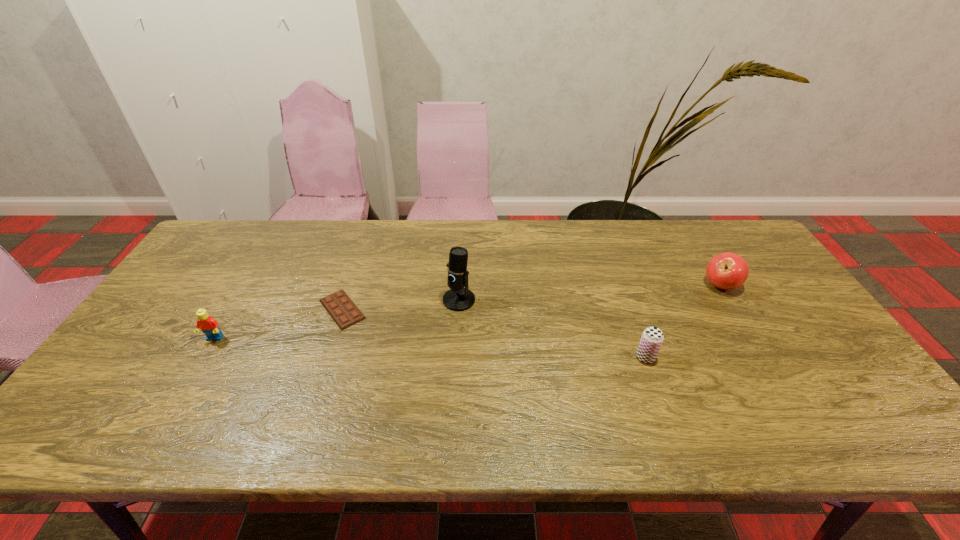
Locate which object is the fourth closest to the second object from right to left. Please provide its 2D coordinates. Your answer should be formatted as a tuple, i.e. [(x, y)], where the tuple contains the x and y coordinates of a point satisfying the conditions above.

[(207, 324)]

What are the coordinates of `vacant region that satisfies the following two spatial constraints: 1. on the face of the fourth farthest object; 2. on the left side of the beer can` in the screenshot? It's located at (204, 357).

This screenshot has height=540, width=960. In order to click on vacant space that satisfies the following two spatial constraints: 1. on the back side of the fourth object from left to right; 2. on the left side of the rightmost object in this screenshot , I will do `click(620, 286)`.